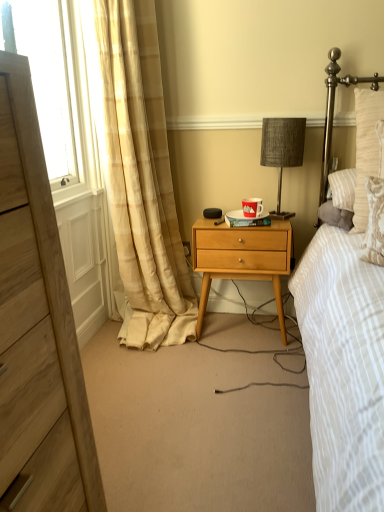
Question: Are wooden chest of drawers at left and wooden nightstand at center making contact?

Choices:
 (A) yes
 (B) no

Answer: (B)

Question: Can you confirm if wooden chest of drawers at left is positioned to the left of wooden nightstand at center?

Choices:
 (A) no
 (B) yes

Answer: (B)

Question: Is wooden chest of drawers at left outside of wooden nightstand at center?

Choices:
 (A) no
 (B) yes

Answer: (B)

Question: Is wooden chest of drawers at left smaller than wooden nightstand at center?

Choices:
 (A) yes
 (B) no

Answer: (B)

Question: Is wooden chest of drawers at left far away from wooden nightstand at center?

Choices:
 (A) no
 (B) yes

Answer: (B)

Question: Is woven fabric headboard at upper right spatially inside transparent glass window screen at left, or outside of it?

Choices:
 (A) outside
 (B) inside

Answer: (A)

Question: Looking at their shapes, would you say woven fabric headboard at upper right is wider or thinner than transparent glass window screen at left?

Choices:
 (A) wide
 (B) thin

Answer: (A)

Question: From a real-world perspective, is woven fabric headboard at upper right above or below transparent glass window screen at left?

Choices:
 (A) above
 (B) below

Answer: (B)

Question: Is woven fabric headboard at upper right bigger or smaller than transparent glass window screen at left?

Choices:
 (A) big
 (B) small

Answer: (B)

Question: From their relative heights in the image, would you say beige plaid curtain at left is taller or shorter than woven fabric headboard at upper right?

Choices:
 (A) tall
 (B) short

Answer: (A)

Question: From a real-world perspective, is beige plaid curtain at left above or below woven fabric headboard at upper right?

Choices:
 (A) above
 (B) below

Answer: (B)

Question: Is point (139, 287) closer or farther from the camera than point (326, 182)?

Choices:
 (A) closer
 (B) farther

Answer: (B)

Question: Is beige plaid curtain at left situated inside woven fabric headboard at upper right or outside?

Choices:
 (A) inside
 (B) outside

Answer: (B)

Question: Is textured gray lampshade at center in front of or behind woven fabric headboard at upper right in the image?

Choices:
 (A) front
 (B) behind

Answer: (B)

Question: From their relative heights in the image, would you say textured gray lampshade at center is taller or shorter than woven fabric headboard at upper right?

Choices:
 (A) tall
 (B) short

Answer: (B)